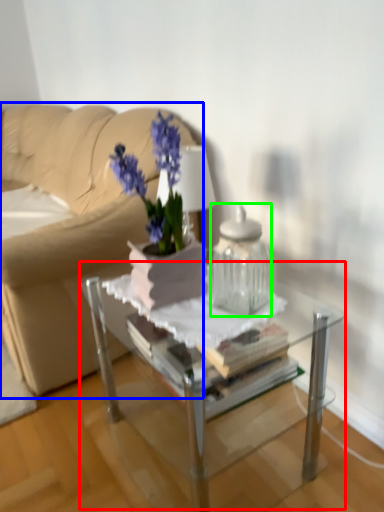
Question: Which is farther away from table (highlighted by a red box)? studio couch (highlighted by a blue box) or vase (highlighted by a green box)?

Choices:
 (A) studio couch
 (B) vase

Answer: (A)